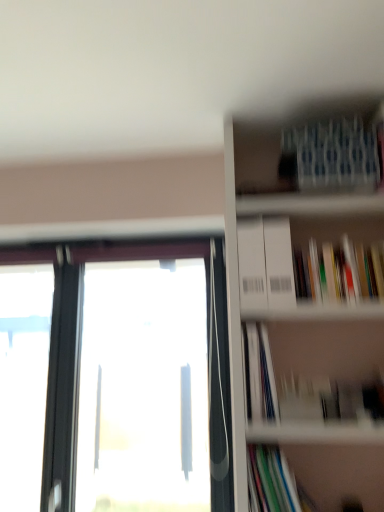
Question: Considering the relative sizes of multicolored paperbacks at upper right, marked as the 2th book in a top-to-bottom arrangement, and transparent glass window at left in the image provided, is multicolored paperbacks at upper right, marked as the 2th book in a top-to-bottom arrangement, taller than transparent glass window at left?

Choices:
 (A) yes
 (B) no

Answer: (B)

Question: Considering the relative positions of multicolored paperbacks at upper right, the third book ordered from the bottom, and transparent glass window at left in the image provided, is multicolored paperbacks at upper right, the third book ordered from the bottom, to the right of transparent glass window at left from the viewer's perspective?

Choices:
 (A) no
 (B) yes

Answer: (B)

Question: Is multicolored paperbacks at upper right, the third book ordered from the bottom, behind transparent glass window at left?

Choices:
 (A) yes
 (B) no

Answer: (B)

Question: Does multicolored paperbacks at upper right, marked as the 2th book in a top-to-bottom arrangement, have a larger size compared to transparent glass window at left?

Choices:
 (A) yes
 (B) no

Answer: (B)

Question: Is multicolored paperbacks at upper right, the third book ordered from the bottom, not inside transparent glass window at left?

Choices:
 (A) yes
 (B) no

Answer: (A)

Question: From a real-world perspective, is transparent glass window at left above or below multicolored paper at lower right, which is counted as the 1th book, starting from the bottom?

Choices:
 (A) above
 (B) below

Answer: (A)

Question: Considering the positions of point (72, 337) and point (283, 474), is point (72, 337) closer or farther from the camera than point (283, 474)?

Choices:
 (A) closer
 (B) farther

Answer: (B)

Question: From the image's perspective, is transparent glass window at left positioned above or below multicolored paper at lower right, which is counted as the 1th book, starting from the bottom?

Choices:
 (A) above
 (B) below

Answer: (A)

Question: In terms of height, does transparent glass window at left look taller or shorter compared to multicolored paper at lower right, placed as the fourth book when sorted from top to bottom?

Choices:
 (A) tall
 (B) short

Answer: (A)

Question: Is white paper at center-right, which ranks as the second book in bottom-to-top order, situated inside transparent glass window at left or outside?

Choices:
 (A) outside
 (B) inside

Answer: (A)

Question: In terms of width, does white paper at center-right, which ranks as the second book in bottom-to-top order, look wider or thinner when compared to transparent glass window at left?

Choices:
 (A) wide
 (B) thin

Answer: (A)

Question: From the image's perspective, is white paper at center-right, which is counted as the third book, starting from the top, above or below transparent glass window at left?

Choices:
 (A) below
 (B) above

Answer: (B)

Question: Is white paper at center-right, which is counted as the third book, starting from the top, bigger or smaller than transparent glass window at left?

Choices:
 (A) big
 (B) small

Answer: (B)

Question: Choose the correct answer: Is transparent glass window at left inside white cardboard bookcase at upper right or outside it?

Choices:
 (A) inside
 (B) outside

Answer: (B)

Question: Considering their positions, is transparent glass window at left located in front of or behind white cardboard bookcase at upper right?

Choices:
 (A) front
 (B) behind

Answer: (B)